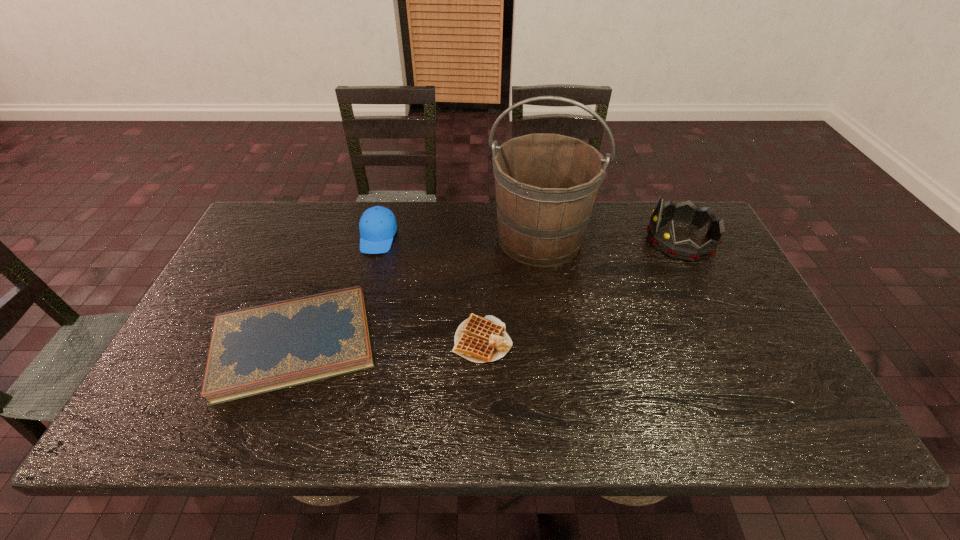
The image size is (960, 540). Identify the location of vacant region between the paperback book and the tallest object. (417, 291).

Locate an element on the screen. vacant area that lies between the tiara and the paperback book is located at coordinates (488, 292).

This screenshot has width=960, height=540. Find the location of `vacant space that's between the paperback book and the waffle`. vacant space that's between the paperback book and the waffle is located at coordinates (388, 342).

Locate an element on the screen. This screenshot has width=960, height=540. free space between the waffle and the paperback book is located at coordinates (388, 342).

What are the coordinates of `free area in between the tallest object and the paperback book` in the screenshot? It's located at (417, 291).

Point out which object is positioned as the third nearest to the tiara. Please provide its 2D coordinates. Your answer should be formatted as a tuple, i.e. [(x, y)], where the tuple contains the x and y coordinates of a point satisfying the conditions above.

[(254, 350)]

Locate an element on the screen. The image size is (960, 540). object that stands as the third closest to the tiara is located at coordinates (254, 350).

You are a GUI agent. You are given a task and a screenshot of the screen. Output one action in this format:
    pyautogui.click(x=<x>, y=<y>)
    Task: Click on the vacant point that satisfies the following two spatial constraints: 1. on the back side of the tallest object; 2. on the right side of the paperback book
    
    Given the screenshot: What is the action you would take?
    pyautogui.click(x=333, y=238)

This screenshot has width=960, height=540. I want to click on free spot that satisfies the following two spatial constraints: 1. on the front-facing side of the cap; 2. on the left side of the bucket, so click(378, 238).

What are the coordinates of `free space that satisfies the following two spatial constraints: 1. on the front-facing side of the bucket; 2. on the right side of the third shortest object` in the screenshot? It's located at (378, 238).